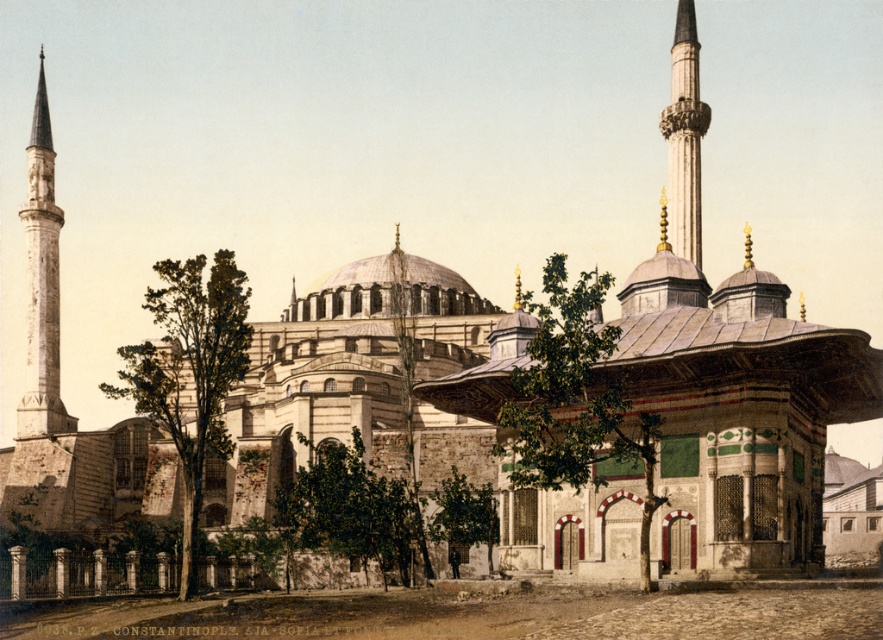
Does point (14, 563) lie behind point (103, 593)?

No, (14, 563) is closer to viewer.

Between point (17, 589) and point (104, 582), which one is positioned behind?

Point (104, 582)

At what (x,y) coordinates should I click in order to perform the action: click on smooth stone pillar at lower left. Please return your answer as a coordinate pair (x, y). This screenshot has width=883, height=640. Looking at the image, I should click on (19, 572).

Locate an element on the screen. Image resolution: width=883 pixels, height=640 pixels. smooth stone pillar at lower left is located at coordinates (19, 572).

Is point (675, 68) closer to viewer compared to point (95, 586)?

No, (675, 68) is further to viewer.

Is white marble minaret at upper center positioned at the back of smooth stone pillar at center?

No, white marble minaret at upper center is closer to the viewer.

The image size is (883, 640). What are the coordinates of `white marble minaret at upper center` in the screenshot? It's located at (684, 136).

Find the location of a particular element. white marble minaret at upper center is located at coordinates (684, 136).

Is point (50, 268) positioned in front of point (136, 568)?

No.

Does white marble minaret at left appear on the right side of dark brown stone pillar at center?

In fact, white marble minaret at left is to the left of dark brown stone pillar at center.

Where is `white marble minaret at left`? Image resolution: width=883 pixels, height=640 pixels. white marble minaret at left is located at coordinates (42, 282).

Identify the location of white marble minaret at left. The height and width of the screenshot is (640, 883). (42, 282).